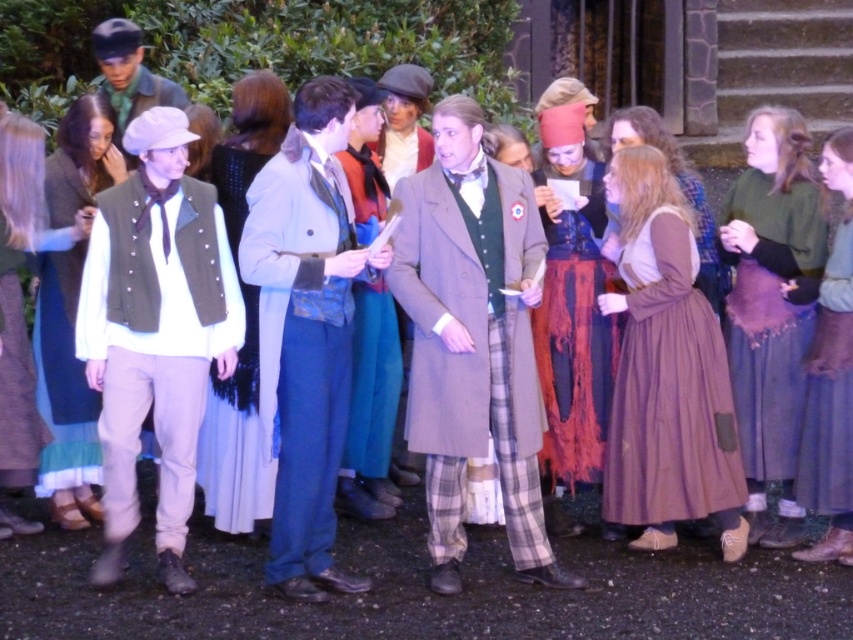
Can you confirm if green woolen dress at right is taller than velvet teal skirt at center?

Indeed, green woolen dress at right has a greater height compared to velvet teal skirt at center.

Who is positioned more to the left, green woolen dress at right or velvet teal skirt at center?

velvet teal skirt at center

Does point (753, 205) come behind point (376, 330)?

No.

At what (x,y) coordinates should I click in order to perform the action: click on green woolen dress at right. Please return your answer as a coordinate pair (x, y). This screenshot has width=853, height=640. Looking at the image, I should click on (770, 307).

Does point (74, 477) lie in front of point (352, 296)?

Yes, it is in front of point (352, 296).

Does white cotton blouse at left appear under velvet teal skirt at center?

Actually, white cotton blouse at left is above velvet teal skirt at center.

Which is in front, point (65, 440) or point (364, 368)?

Point (65, 440) is in front.

Where is `white cotton blouse at left`? white cotton blouse at left is located at coordinates (65, 394).

Does brown cotton dress at center have a greater height compared to matte green scarf at upper left?

Yes.

Who is more distant from viewer, (611, 461) or (142, 109)?

The point (142, 109) is more distant.

At what (x,y) coordinates should I click in order to perform the action: click on brown cotton dress at center. Please return your answer as a coordinate pair (x, y). The width and height of the screenshot is (853, 640). Looking at the image, I should click on (666, 372).